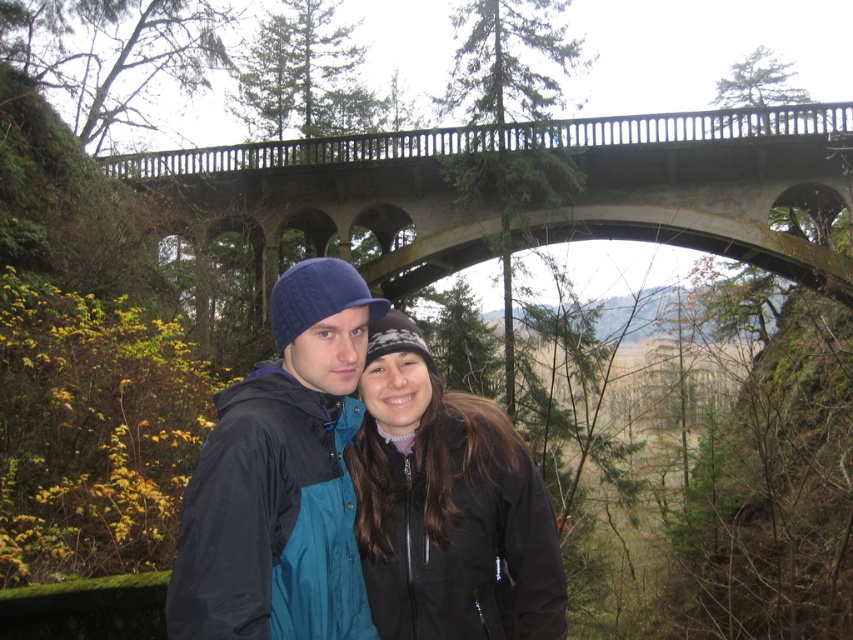
Question: Which object is farther from the camera taking this photo?

Choices:
 (A) black softshell jacket at center
 (B) blue knit cap at center

Answer: (A)

Question: Is blue knit cap at center below black softshell jacket at center?

Choices:
 (A) yes
 (B) no

Answer: (B)

Question: Which point is farther to the camera?

Choices:
 (A) (445, 602)
 (B) (279, 618)
 (C) (318, 189)

Answer: (C)

Question: Which point appears farthest from the camera in this image?

Choices:
 (A) (827, 116)
 (B) (447, 605)
 (C) (288, 294)

Answer: (A)

Question: Does concrete bridge at upper center appear on the left side of black softshell jacket at center?

Choices:
 (A) no
 (B) yes

Answer: (A)

Question: Is concrete bridge at upper center above black softshell jacket at center?

Choices:
 (A) no
 (B) yes

Answer: (B)